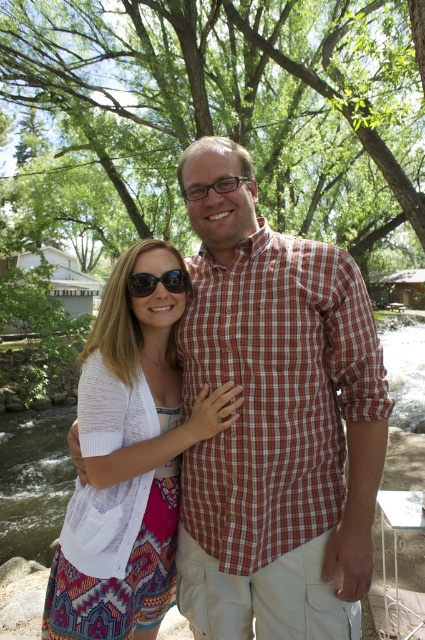
You are a photographer aiming to capture a photo of the white textured cardigan at center and the green water at creek center. Which object should you focus on first if you want to include both in your shot without moving the camera?

The white textured cardigan at center is to the left of green water at creek center, so you should focus on the white textured cardigan at center first to ensure both are in frame.